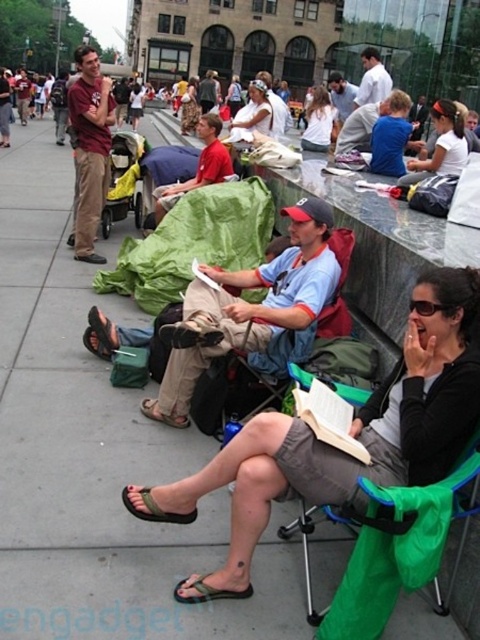
Is point (441, 124) behind point (346, 234)?

That is True.

Can you confirm if matte white shirt at upper center is positioned to the right of green fabric chair at center?

Correct, you'll find matte white shirt at upper center to the right of green fabric chair at center.

Measure the distance between matte white shirt at upper center and camera.

matte white shirt at upper center is 7.57 meters away from camera.

The image size is (480, 640). I want to click on matte white shirt at upper center, so click(x=441, y=145).

In the scene shown: Is green fabric chair at lower right bigger than green fabric sandal at lower left?

Indeed, green fabric chair at lower right has a larger size compared to green fabric sandal at lower left.

Who is positioned more to the right, green fabric chair at lower right or green fabric sandal at lower left?

Positioned to the right is green fabric chair at lower right.

Describe the element at coordinates (389, 547) in the screenshot. The height and width of the screenshot is (640, 480). I see `green fabric chair at lower right` at that location.

This screenshot has width=480, height=640. Find the location of `green fabric chair at lower right`. green fabric chair at lower right is located at coordinates (389, 547).

Can you confirm if gray fabric shorts at center is shorter than matte white shirt at upper center?

In fact, gray fabric shorts at center may be taller than matte white shirt at upper center.

Who is higher up, gray fabric shorts at center or matte white shirt at upper center?

matte white shirt at upper center is above.

The width and height of the screenshot is (480, 640). Identify the location of gray fabric shorts at center. (357, 428).